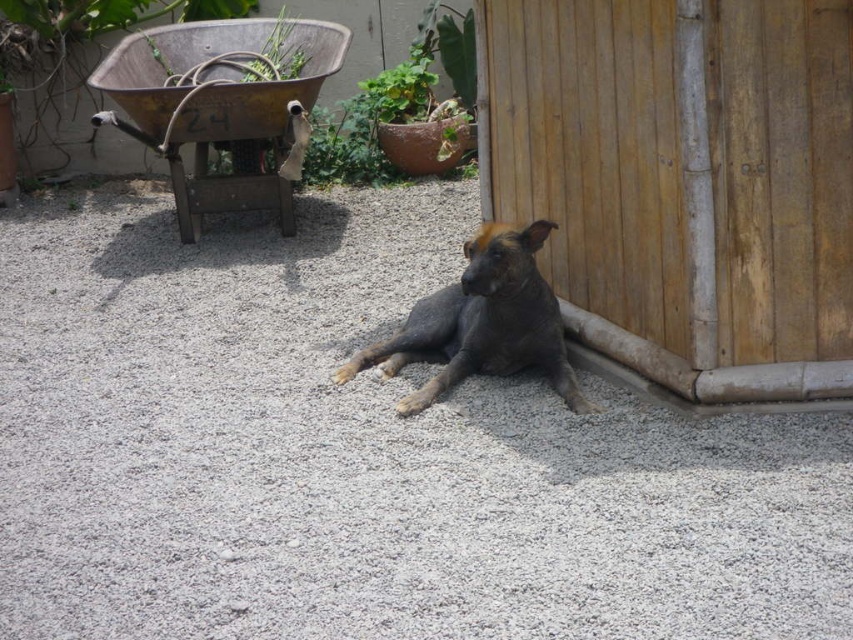
Question: Which point is farther from the camera taking this photo?

Choices:
 (A) (544, 429)
 (B) (494, 252)

Answer: (B)

Question: Is gray gravel at center smaller than dark gray fur dog at center?

Choices:
 (A) no
 (B) yes

Answer: (A)

Question: Is gray gravel at center wider than dark gray fur dog at center?

Choices:
 (A) yes
 (B) no

Answer: (A)

Question: Is gray gravel at center positioned in front of dark gray fur dog at center?

Choices:
 (A) yes
 (B) no

Answer: (A)

Question: Which point appears farthest from the camera in this image?

Choices:
 (A) (218, 356)
 (B) (425, 298)

Answer: (B)